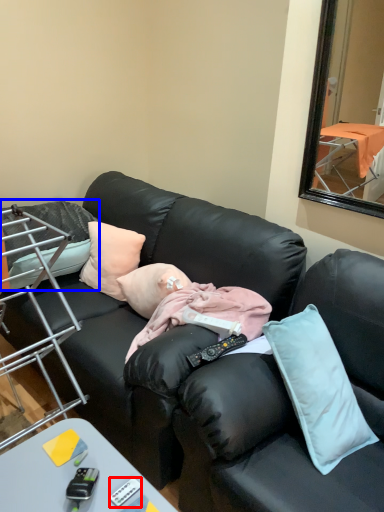
Question: Which of the following is the farthest to the observer, remote control (highlighted by a red box) or pillow (highlighted by a blue box)?

Choices:
 (A) remote control
 (B) pillow

Answer: (B)